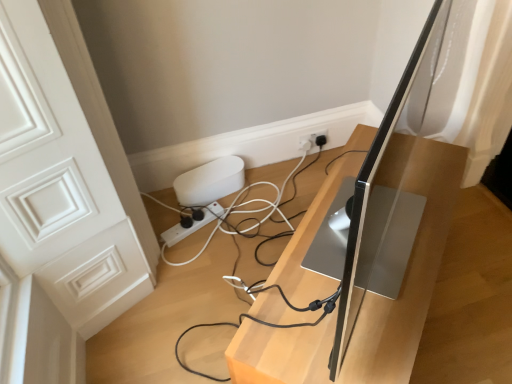
Identify the location of vacant space to the left of silver metallic monitor at center. (196, 293).